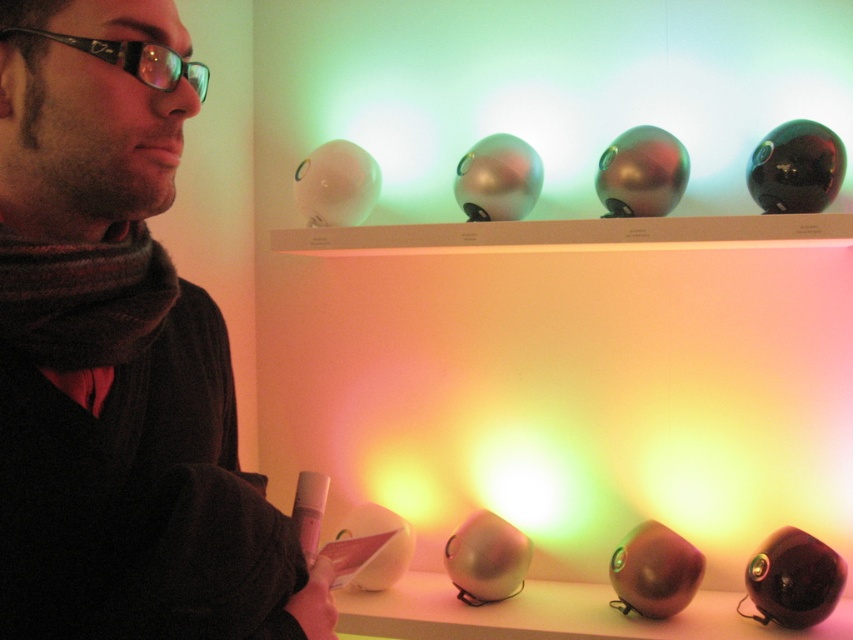
Is matte black scarf at left positioned in front of metallic silver sphere at lower center?

Yes, matte black scarf at left is closer to the viewer.

Is matte black scarf at left positioned behind metallic silver sphere at lower center?

No.

The width and height of the screenshot is (853, 640). What do you see at coordinates (119, 355) in the screenshot? I see `matte black scarf at left` at bounding box center [119, 355].

Find the location of a particular element. matte black scarf at left is located at coordinates (119, 355).

Is knitted dark brown scarf at left shorter than metallic silver sphere at lower center?

No, knitted dark brown scarf at left is not shorter than metallic silver sphere at lower center.

Identify the location of knitted dark brown scarf at left. The image size is (853, 640). (83, 298).

Measure the distance between matte black scarf at left and black plastic glasses at upper left.

matte black scarf at left and black plastic glasses at upper left are 8.73 inches apart from each other.

Is matte black scarf at left taller than black plastic glasses at upper left?

A: Correct, matte black scarf at left is much taller as black plastic glasses at upper left.

Is point (57, 611) farther from camera compared to point (161, 80)?

No, (57, 611) is closer to viewer.

At what (x,y) coordinates should I click in order to perform the action: click on matte black scarf at left. Please return your answer as a coordinate pair (x, y). The width and height of the screenshot is (853, 640). Looking at the image, I should click on tap(119, 355).